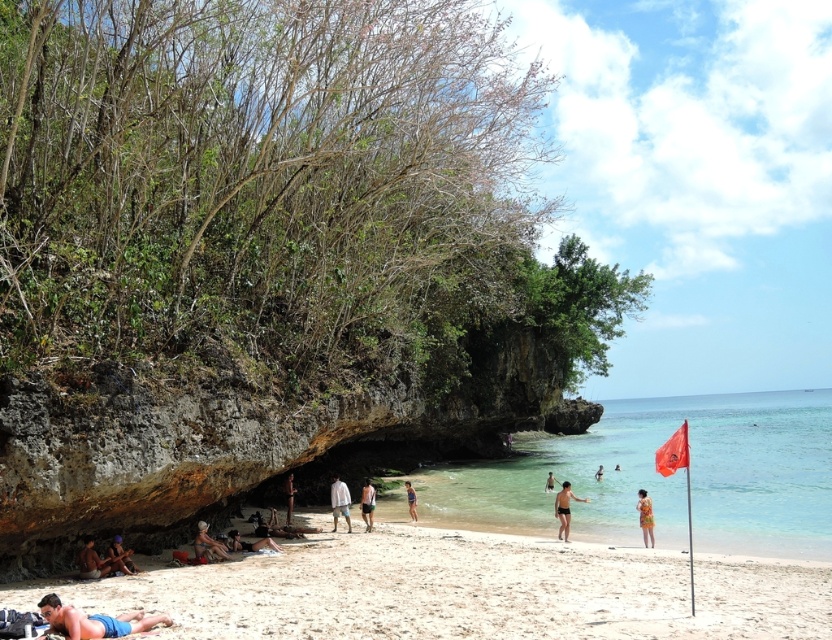
Question: Which of the following is the farthest from the observer?

Choices:
 (A) black matte swimsuit at center
 (B) green fabric shorts at center
 (C) orange floral dress at center
 (D) white sandy beach at lower center

Answer: (C)

Question: Which is nearer to the black swimsuit at center?

Choices:
 (A) smooth tan skin at lower left
 (B) blue cotton shorts at lower left

Answer: (A)

Question: Among these objects, which one is farthest from the camera?

Choices:
 (A) printed fabric swimsuit at lower right
 (B) black matte swimsuit at center

Answer: (B)

Question: In this image, where is green fabric shorts at center located relative to smooth skin person at center?

Choices:
 (A) left
 (B) right

Answer: (A)

Question: Observing the image, what is the correct spatial positioning of black matte swimsuit at center in reference to blue fabric towel at lower left?

Choices:
 (A) above
 (B) below

Answer: (B)

Question: Is matte black surfboard at center to the left of orange floral dress at center from the viewer's perspective?

Choices:
 (A) no
 (B) yes

Answer: (B)